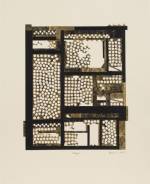
Image resolution: width=150 pixels, height=184 pixels. In order to click on rectangular room in this screenshot , I will do `click(44, 46)`, `click(78, 141)`, `click(76, 127)`, `click(96, 131)`, `click(110, 134)`, `click(114, 59)`.